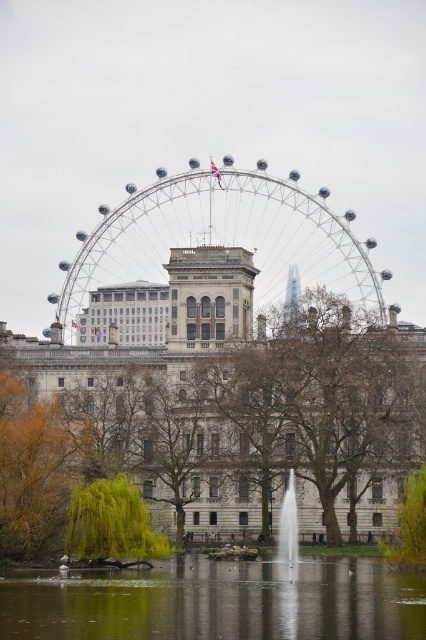
You are standing in front of the golden leafy tree at lower left and the green leafy tree at lower left. Which tree do you see first when looking down?

The green leafy tree at lower left is seen first when looking down because it is positioned below the golden leafy tree at lower left.

You are standing in the city park looking at the London Eye Ferris wheel and the fountain. There are two points marked on the scene, one at coordinates point (184, 186) and another at point (425, 552). Which point is closer to your position as the observer?

Point (184, 186) is further to the camera than point (425, 552). Therefore, the point closer to the observer is point (425, 552).